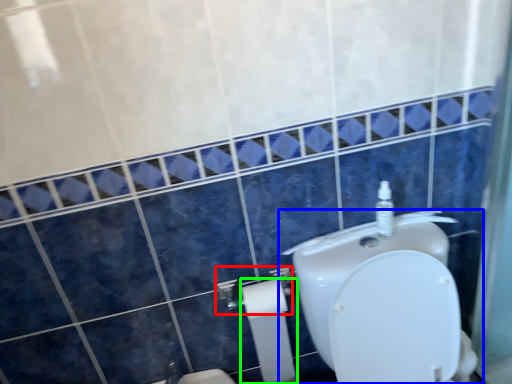
Question: Which object is the closest to the shower (highlighted by a red box)? Choose among these: toilet (highlighted by a blue box) or toilet paper (highlighted by a green box).

Choices:
 (A) toilet
 (B) toilet paper

Answer: (B)